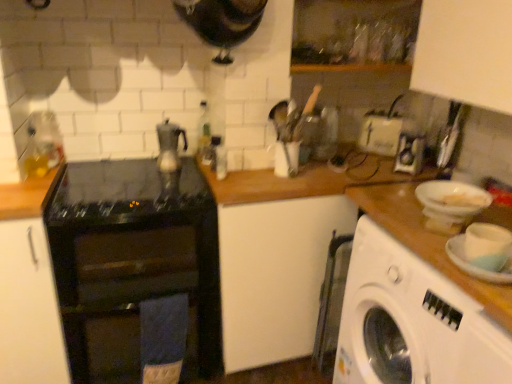
Find the location of a particular element. free spot in front of white plastic toaster at center, placed as the first appliance when sorted from back to front is located at coordinates (370, 157).